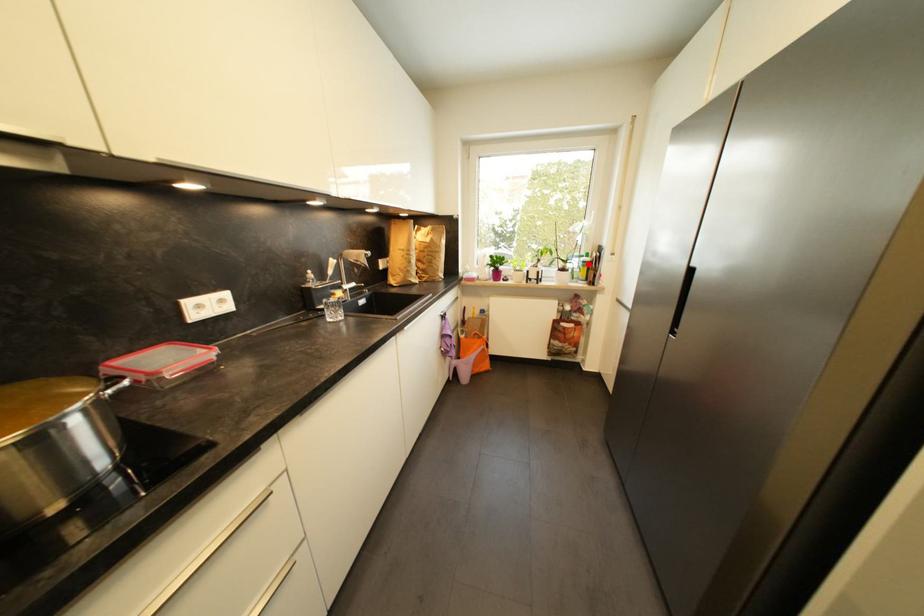
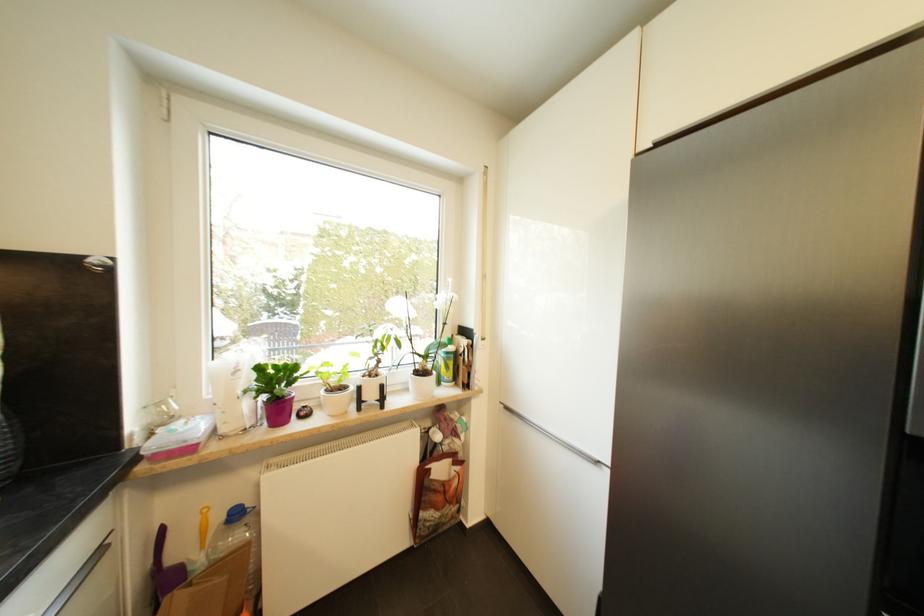
Question: A red point is marked in image1. In image2, is the corresponding 3D point closer to the camera or farther? Reply with the corresponding letter.

Choices:
 (A) The corresponding 3D point is closer.
 (B) The corresponding 3D point is farther.

Answer: (B)